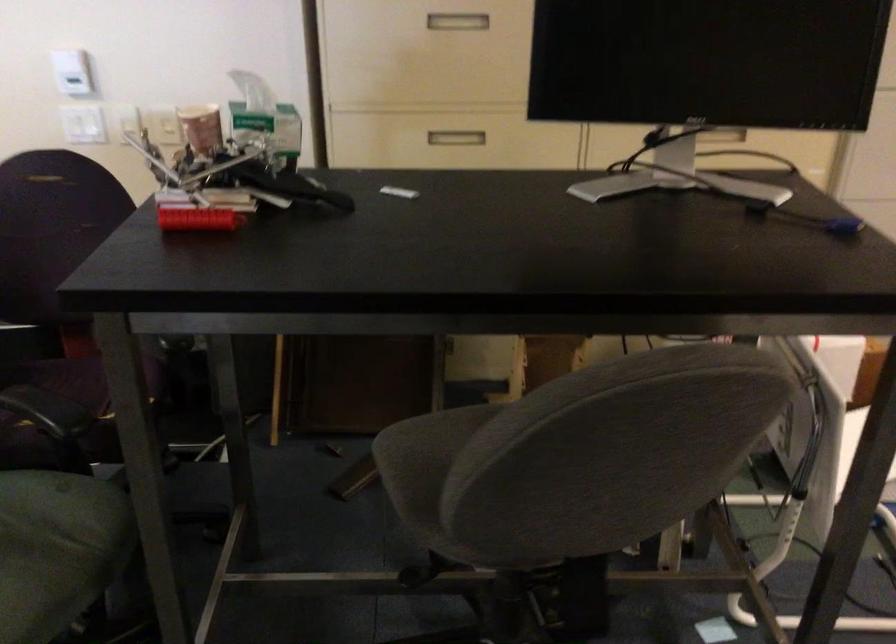
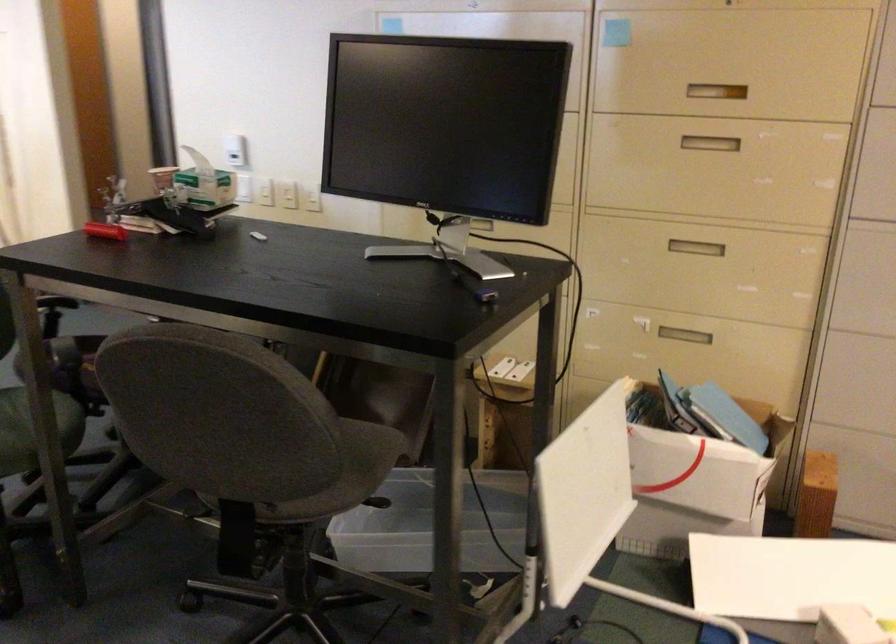
Locate, in the second image, the point that corresponds to point (100, 127) in the first image.

(243, 187)